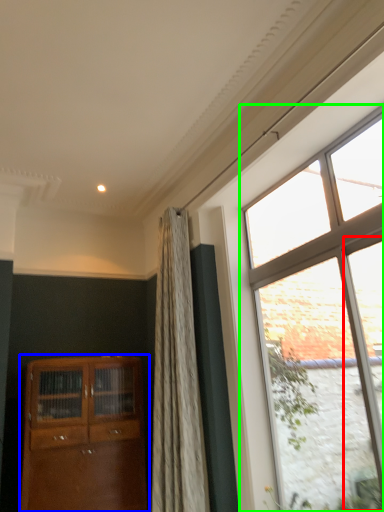
Question: Estimate the real-world distances between objects in this image. Which object is farther from glass door (highlighted by a red box), cabinetry (highlighted by a blue box) or window (highlighted by a green box)?

Choices:
 (A) cabinetry
 (B) window

Answer: (A)